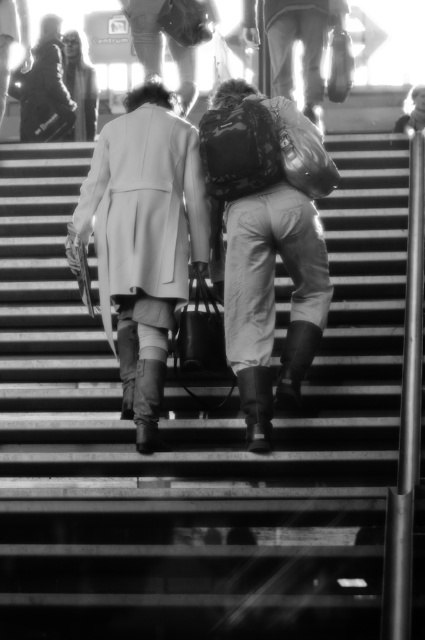
Question: Can you confirm if white matte coat at center is positioned to the left of matte gray coat at upper left?

Choices:
 (A) no
 (B) yes

Answer: (A)

Question: Which object is the closest to the camouflage backpack at center?

Choices:
 (A) white matte coat at center
 (B) matte gray coat at upper left

Answer: (A)

Question: Does camouflage backpack at center appear under white matte coat at center?

Choices:
 (A) no
 (B) yes

Answer: (B)

Question: Can you confirm if camouflage backpack at center is bigger than matte gray coat at upper left?

Choices:
 (A) yes
 (B) no

Answer: (A)

Question: Which is farther from the matte gray coat at upper left?

Choices:
 (A) camouflage backpack at center
 (B) white matte coat at center

Answer: (A)

Question: Which point is closer to the camera?

Choices:
 (A) camouflage backpack at center
 (B) matte gray coat at upper left

Answer: (A)